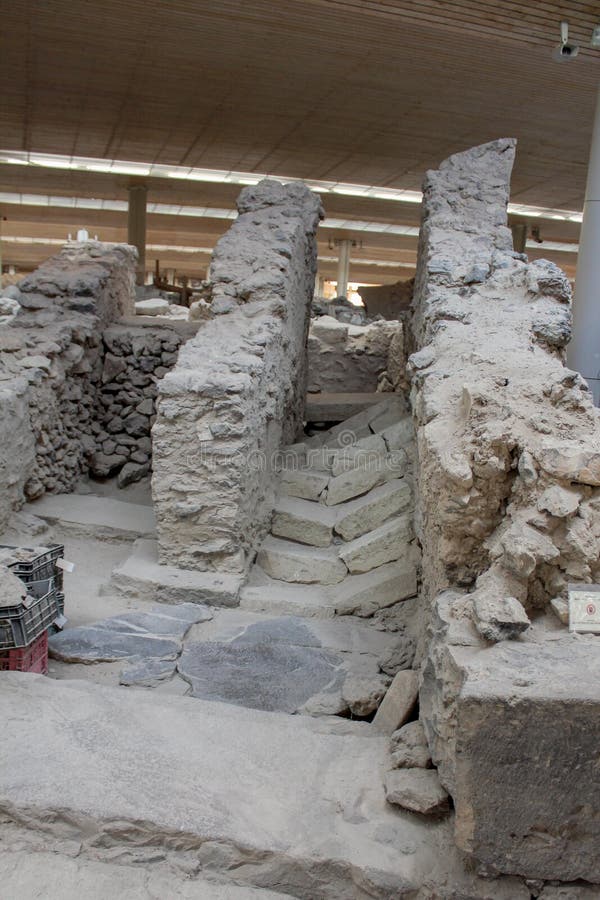
The width and height of the screenshot is (600, 900). I want to click on medium crumbling wall, so click(x=258, y=250).